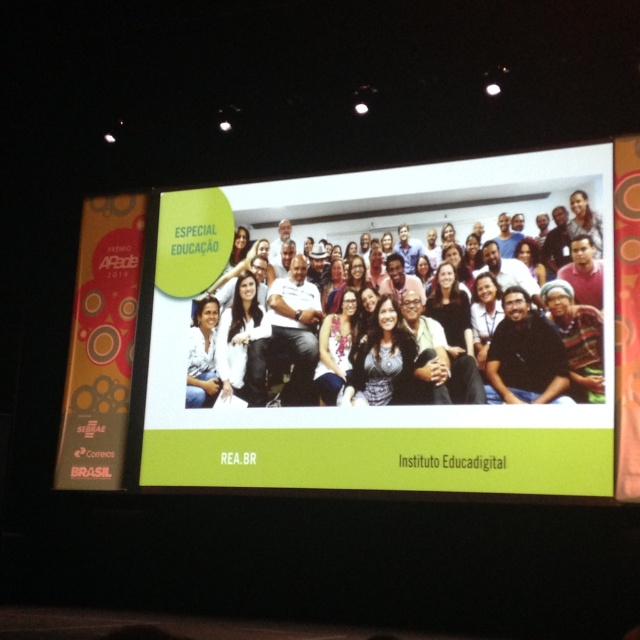
Question: Can you confirm if white glossy projection screen at center is positioned above white fabric at center?

Choices:
 (A) no
 (B) yes

Answer: (A)

Question: Which point is closer to the camera?

Choices:
 (A) (534, 330)
 (B) (264, 362)

Answer: (A)

Question: Can you confirm if white glossy projection screen at center is wider than white fabric at center?

Choices:
 (A) yes
 (B) no

Answer: (B)

Question: Among these objects, which one is farthest from the camera?

Choices:
 (A) white fabric at center
 (B) white glossy projection screen at center

Answer: (B)

Question: Does white glossy projection screen at center have a greater width compared to white fabric at center?

Choices:
 (A) no
 (B) yes

Answer: (A)